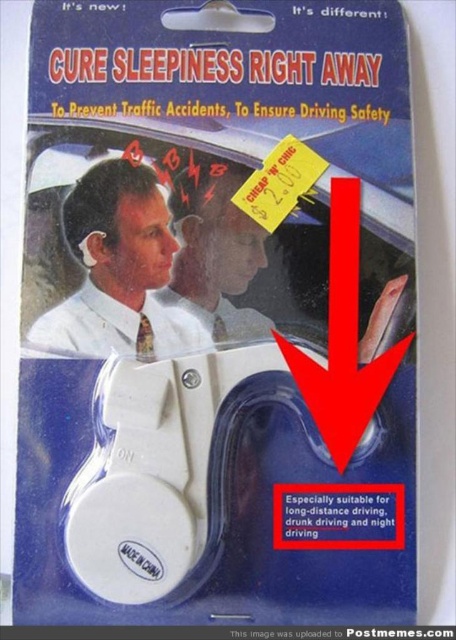
Question: Which point is closer to the camera taking this photo?

Choices:
 (A) (200, 285)
 (B) (114, 330)

Answer: (B)

Question: Among these objects, which one is farthest from the camera?

Choices:
 (A) white matte tie at upper center
 (B) matte white headband at upper center

Answer: (B)

Question: Is white matte tie at upper center smaller than matte white headband at upper center?

Choices:
 (A) yes
 (B) no

Answer: (B)

Question: Among these objects, which one is nearest to the camera?

Choices:
 (A) white matte tie at upper center
 (B) matte white headband at upper center

Answer: (A)

Question: Does white matte tie at upper center appear over matte white headband at upper center?

Choices:
 (A) no
 (B) yes

Answer: (A)

Question: Is white matte tie at upper center positioned at the back of matte white headband at upper center?

Choices:
 (A) yes
 (B) no

Answer: (B)